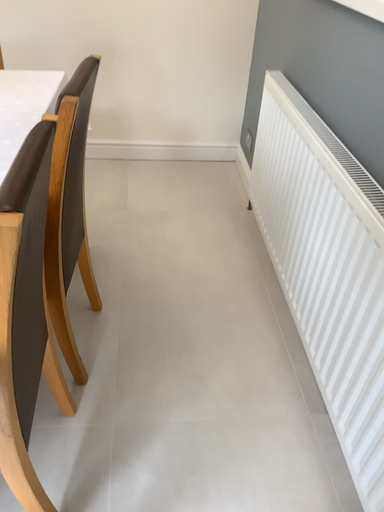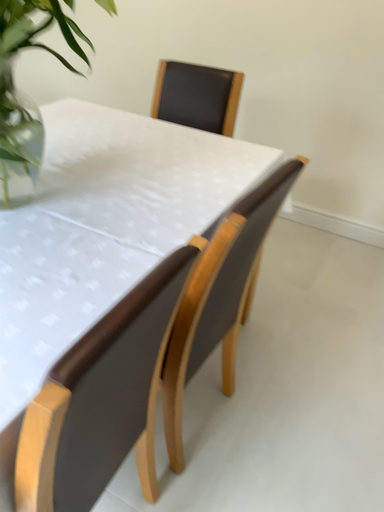
Question: How did the camera likely rotate when shooting the video?

Choices:
 (A) rotated left
 (B) rotated right

Answer: (A)